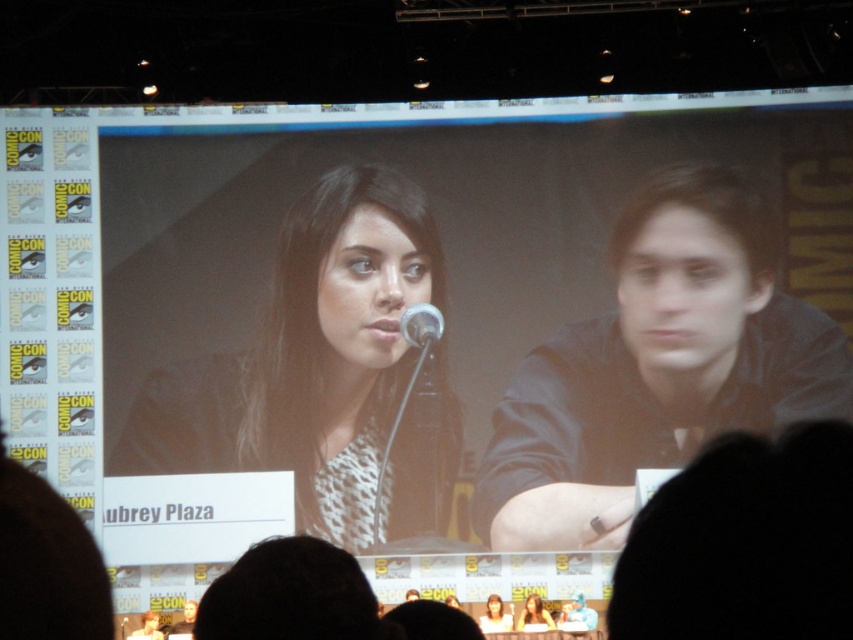
Question: Considering the relative positions of dark gray shirt at right and matte white shirt at center in the image provided, where is dark gray shirt at right located with respect to matte white shirt at center?

Choices:
 (A) left
 (B) right

Answer: (B)

Question: Considering the relative positions of dark gray shirt at right and metallic silver microphone at center in the image provided, where is dark gray shirt at right located with respect to metallic silver microphone at center?

Choices:
 (A) right
 (B) left

Answer: (A)

Question: Is metallic silver microphone at center to the left of matte black dress at center from the viewer's perspective?

Choices:
 (A) no
 (B) yes

Answer: (B)

Question: Which object is positioned closest to the metallic silver microphone at center?

Choices:
 (A) matte white shirt at center
 (B) leopard print dress at center
 (C) matte black dress at center

Answer: (B)

Question: Which point is farther to the camera?

Choices:
 (A) matte white shirt at center
 (B) metallic silver microphone at center

Answer: (B)

Question: Which point is closer to the camera taking this photo?

Choices:
 (A) (413, 312)
 (B) (525, 604)
 (C) (759, 234)

Answer: (B)